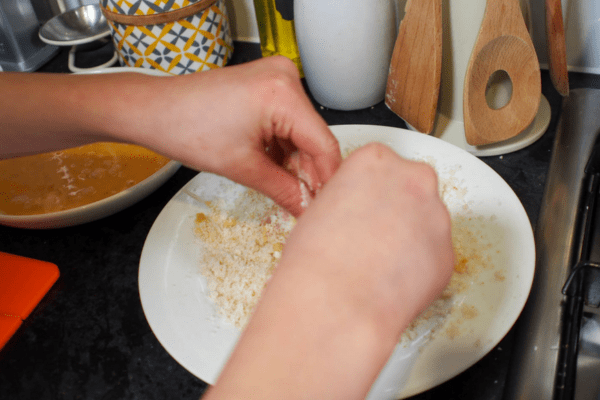
Locate an element on the screen. rims of bowls is located at coordinates (451, 143), (113, 194).